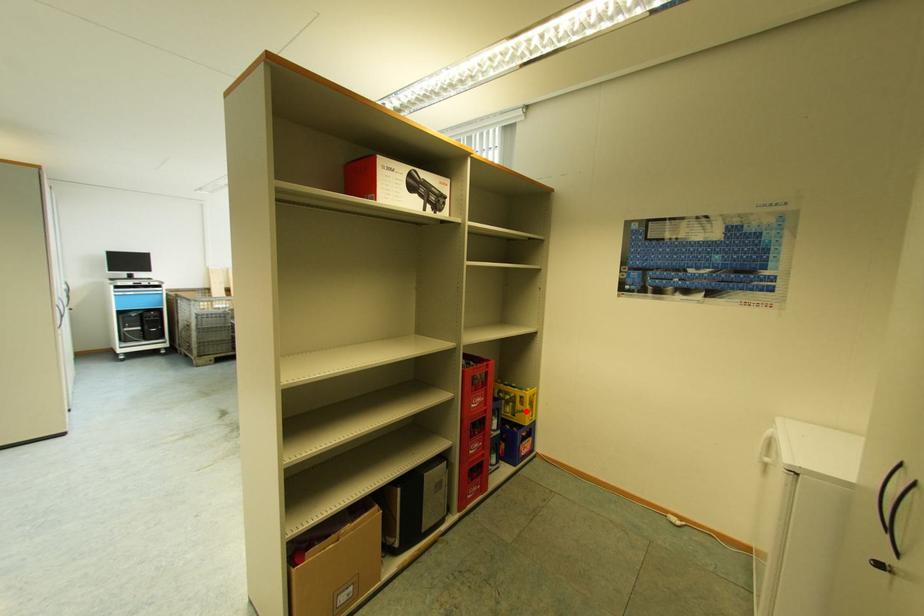
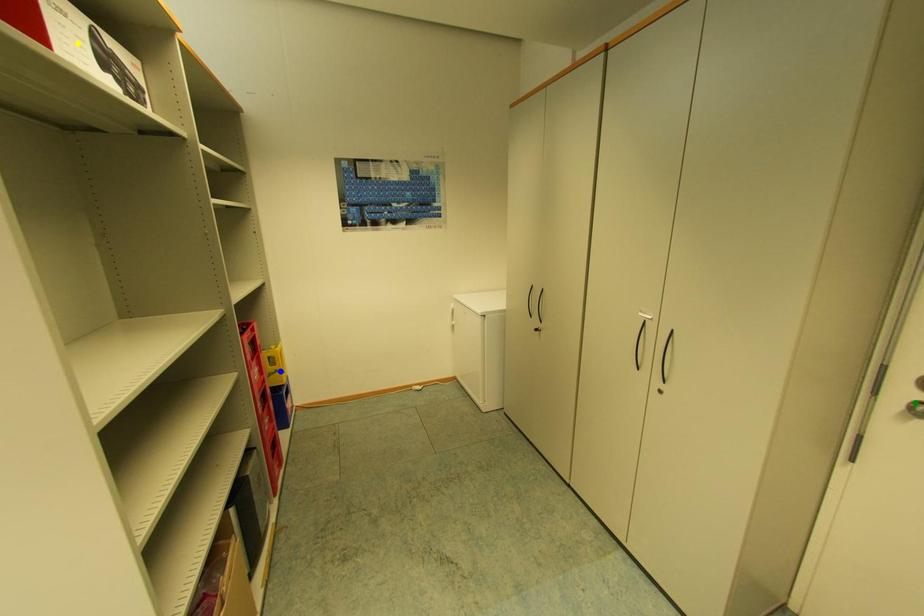
Question: I am providing you with two images of the same scene from different viewpoints. A red point is marked on the first image. You are given multiple points on the second image. Which spot in image 2 lines up with the point in image 1?

Choices:
 (A) blue point
 (B) green point
 (C) yellow point

Answer: (A)